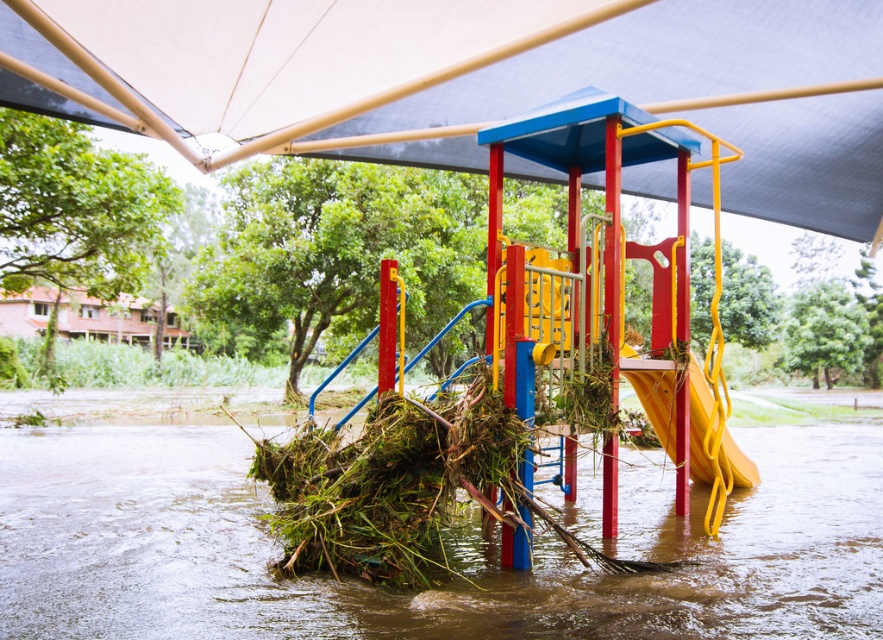
You are a photographer standing at the camera position. You want to take a photo of the white fabric canopy at upper center. Can you fit the entire canopy into your camera frame if your camera has a maximum horizontal field of view of 5 meters?

The white fabric canopy at upper center and camera are 5.83 meters apart. Since the distance between them is greater than the camera frame width of 5 meters, the entire canopy cannot be captured in one shot.